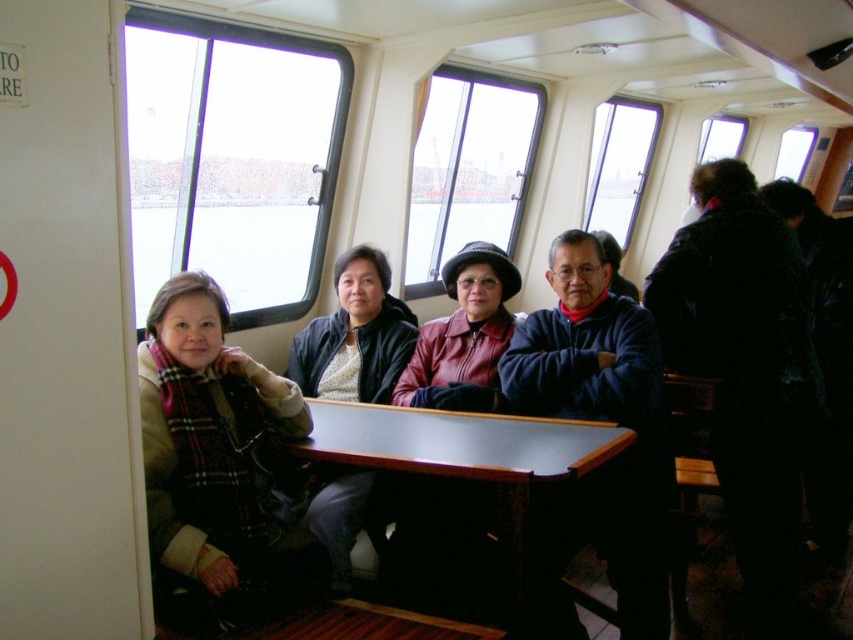
How distant is black wood table at center from black matte jacket at center?

black wood table at center is 30.31 inches from black matte jacket at center.

Who is more forward, (602, 442) or (344, 253)?

Point (602, 442)

Locate an element on the screen. black wood table at center is located at coordinates (466, 456).

Who is higher up, blue fleece jacket at center or black matte jacket at center?

black matte jacket at center is higher up.

Does blue fleece jacket at center have a greater width compared to black matte jacket at center?

No, blue fleece jacket at center is not wider than black matte jacket at center.

The width and height of the screenshot is (853, 640). In order to click on blue fleece jacket at center in this screenshot , I will do `click(598, 420)`.

Can you confirm if plaid scarf at left is positioned to the right of black matte jacket at center?

In fact, plaid scarf at left is to the left of black matte jacket at center.

Is plaid scarf at left thinner than black matte jacket at center?

Yes, plaid scarf at left is thinner than black matte jacket at center.

Between point (289, 432) and point (308, 528), which one is positioned behind?

The point (308, 528) is behind.

The image size is (853, 640). I want to click on plaid scarf at left, so click(x=218, y=460).